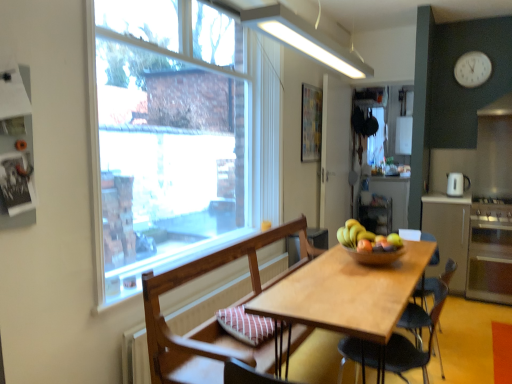
What do you see at coordinates (311, 123) in the screenshot? I see `abstract painting at upper right` at bounding box center [311, 123].

What do you see at coordinates (179, 140) in the screenshot?
I see `clear glass window at upper left` at bounding box center [179, 140].

What is the approximate width of white glossy coffee machine at right?

white glossy coffee machine at right is 6.48 inches wide.

Measure the distance between point (389, 352) and camera.

5.60 feet.

You are a GUI agent. You are given a task and a screenshot of the screen. Output one action in this format:
    pyautogui.click(x=<x>, y=<y>)
    Task: Click on the abstract painting at upper right
    Image resolution: width=512 pixels, height=384 pixels.
    Given the screenshot: What is the action you would take?
    pyautogui.click(x=311, y=123)

Is red matte apple at center positioned before light brown wooden table at center?

No, red matte apple at center is behind light brown wooden table at center.

From the image's perspective, is red matte apple at center positioned above or below light brown wooden table at center?

red matte apple at center is situated higher than light brown wooden table at center in the image.

Looking at this image, from a real-world perspective, is red matte apple at center physically located above or below light brown wooden table at center?

Clearly, from a real-world perspective, red matte apple at center is above light brown wooden table at center.

Where is `kitchen & dining room table in front of the red matte apple at center`? This screenshot has height=384, width=512. kitchen & dining room table in front of the red matte apple at center is located at coordinates (348, 295).

Can light brown wooden table at center be found inside satin silver stove at right?

No, light brown wooden table at center is not a part of satin silver stove at right.

Is satin silver stove at right at the left side of light brown wooden table at center?

Incorrect, satin silver stove at right is not on the left side of light brown wooden table at center.

Measure the distance between light brown wooden table at center and white glossy refrigerator at upper right.

9.75 feet.

Would you say light brown wooden table at center is inside or outside white glossy refrigerator at upper right?

light brown wooden table at center is spatially situated outside white glossy refrigerator at upper right.

Could you tell me if light brown wooden table at center is turned towards white glossy refrigerator at upper right?

No, light brown wooden table at center is not facing towards white glossy refrigerator at upper right.

Can you confirm if light brown wooden table at center is positioned to the left of white glossy refrigerator at upper right?

Correct, you'll find light brown wooden table at center to the left of white glossy refrigerator at upper right.

In terms of width, does wooden chair with cushion at center, which ranks as the first chair in front-to-back order, look wider or thinner when compared to white glossy coffee machine at right?

Considering their sizes, wooden chair with cushion at center, which ranks as the first chair in front-to-back order, looks broader than white glossy coffee machine at right.

From the image's perspective, is wooden chair with cushion at center, positioned as the second chair in back-to-front order, over white glossy coffee machine at right?

No, from the image's perspective, wooden chair with cushion at center, positioned as the second chair in back-to-front order, is not on top of white glossy coffee machine at right.

Would you consider wooden chair with cushion at center, which ranks as the first chair in front-to-back order, to be distant from white glossy coffee machine at right?

Indeed, wooden chair with cushion at center, which ranks as the first chair in front-to-back order, is not near white glossy coffee machine at right.

Does wooden chair with cushion at center, which ranks as the first chair in front-to-back order, have a greater height compared to white glossy coffee machine at right?

Yes, wooden chair with cushion at center, which ranks as the first chair in front-to-back order, is taller than white glossy coffee machine at right.

Can you confirm if white glossy refrigerator at upper right is smaller than white fluorescent light at upper center?

Yes, white glossy refrigerator at upper right is smaller than white fluorescent light at upper center.

Is point (396, 149) closer to camera compared to point (285, 22)?

No, (396, 149) is further to viewer.

Can you see white glossy refrigerator at upper right touching white fluorescent light at upper center?

white glossy refrigerator at upper right is not next to white fluorescent light at upper center, and they're not touching.

Is white fluorescent light at upper center located within wooden bowl at center?

No, white fluorescent light at upper center is located outside of wooden bowl at center.

Which is less distant, [394,259] or [307,55]?

Answer: Point [394,259].

Looking at this image, is wooden bowl at center further to camera compared to white fluorescent light at upper center?

Yes, wooden bowl at center is behind white fluorescent light at upper center.

From a real-world perspective, is white plastic clock at upper right physically located above or below white fluorescent light at upper center?

Clearly, from a real-world perspective, white plastic clock at upper right is above white fluorescent light at upper center.

From the image's perspective, which is below, white plastic clock at upper right or white fluorescent light at upper center?

white fluorescent light at upper center is shown below in the image.

How different are the orientations of white plastic clock at upper right and white fluorescent light at upper center in degrees?

white plastic clock at upper right and white fluorescent light at upper center are facing 180 degrees away from each other.

At what (x,y) coordinates should I click in order to perform the action: click on light fixture below the white plastic clock at upper right (from a real-world perspective). Please return your answer as a coordinate pair (x, y). Looking at the image, I should click on (304, 39).

At what (x,y) coordinates should I click in order to perform the action: click on kitchen & dining room table below the red matte apple at center (from a real-world perspective). Please return your answer as a coordinate pair (x, y). Looking at the image, I should click on (348, 295).

You are a GUI agent. You are given a task and a screenshot of the screen. Output one action in this format:
    pyautogui.click(x=<x>, y=<y>)
    Task: Click on the stove located behind the light brown wooden table at center
    
    Given the screenshot: What is the action you would take?
    pyautogui.click(x=492, y=209)

From the image, which object appears to be farther from matte white cabinet at right, satin silver stove at right or red matte apple at center?

Among the two, red matte apple at center is located further to matte white cabinet at right.

Which object lies nearer to the anchor point clear glass window at upper left, white fluorescent light at upper center or red matte apple at center?

white fluorescent light at upper center is closer to clear glass window at upper left.

Considering their positions, is satin silver stove at right positioned closer to wooden bowl at center than clear glass window at upper left?

clear glass window at upper left lies closer to wooden bowl at center than the other object.

Which object lies nearer to the anchor point matte white cabinet at right, wooden chair at center, which is the 2th chair in front-to-back order, or white fluorescent light at upper center?

The object closer to matte white cabinet at right is wooden chair at center, which is the 2th chair in front-to-back order.

Which object lies nearer to the anchor point abstract painting at upper right, light brown wooden table at center or white plastic clock at upper right?

Based on the image, white plastic clock at upper right appears to be nearer to abstract painting at upper right.

Looking at the image, which one is located closer to white glossy coffee machine at right, abstract painting at upper right or light brown wooden table at center?

Among the two, abstract painting at upper right is located nearer to white glossy coffee machine at right.

When comparing their distances from wooden bowl at center, does wooden chair with cushion at center, positioned as the second chair in back-to-front order, or wooden chair at center, the first chair when ordered from back to front, seem further?

Among the two, wooden chair with cushion at center, positioned as the second chair in back-to-front order, is located further to wooden bowl at center.

From the image, which object appears to be farther from satin silver oven at right, white fluorescent light at upper center or matte white cabinet at right?

white fluorescent light at upper center is positioned further to the anchor satin silver oven at right.

Where is `clock between satin silver oven at right and white glossy refrigerator at upper right in the front-back direction`? The height and width of the screenshot is (384, 512). clock between satin silver oven at right and white glossy refrigerator at upper right in the front-back direction is located at coordinates (472, 69).

Locate an element on the screen. The width and height of the screenshot is (512, 384). bowl between light brown wooden table at center and white glossy refrigerator at upper right in the front-back direction is located at coordinates (375, 256).

This screenshot has width=512, height=384. Find the location of `stove positioned between wooden chair with cushion at center, which ranks as the first chair in front-to-back order, and white plastic clock at upper right from near to far`. stove positioned between wooden chair with cushion at center, which ranks as the first chair in front-to-back order, and white plastic clock at upper right from near to far is located at coordinates coord(492,209).

This screenshot has height=384, width=512. Identify the location of coffee machine between white plastic clock at upper right and satin silver stove at right in the vertical direction. (457, 184).